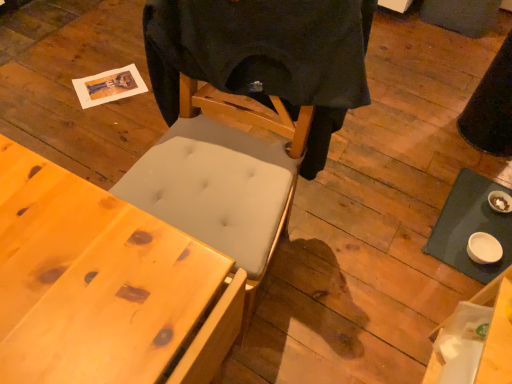
The width and height of the screenshot is (512, 384). I want to click on vacant space to the left of white matte table at lower right, so click(x=385, y=218).